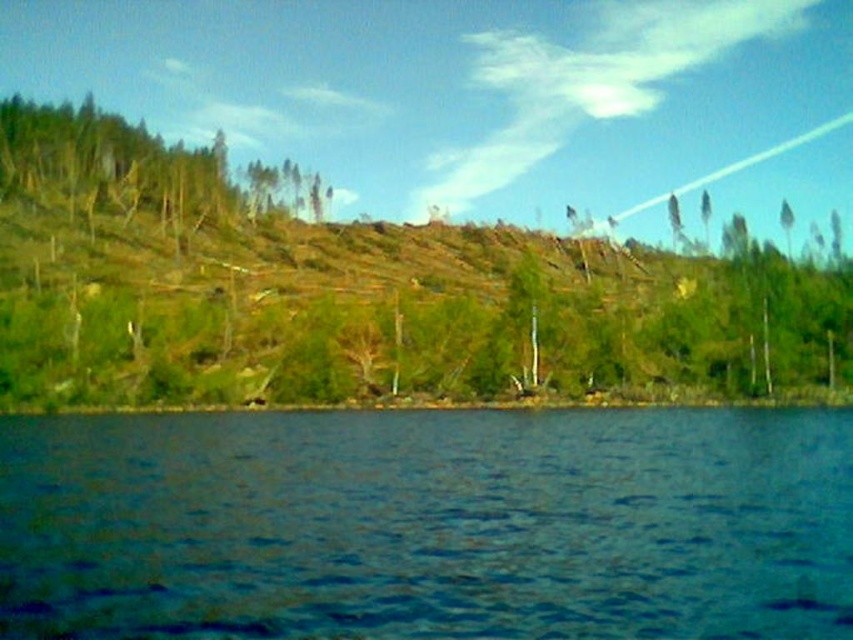
Which of these two, blue liquid water at lower center or green matte tree at upper left, stands taller?

Standing taller between the two is green matte tree at upper left.

Identify the location of blue liquid water at lower center. This screenshot has height=640, width=853. (428, 525).

Between point (779, 412) and point (207, 188), which one is positioned in front?

Point (779, 412) is in front.

Locate an element on the screen. This screenshot has width=853, height=640. blue liquid water at lower center is located at coordinates (428, 525).